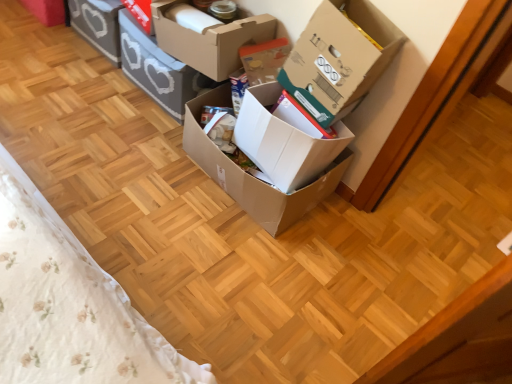
Question: Is the position of cardboard box at center, arranged as the 5th box when viewed from the left, more distant than that of cardboard box at upper right, the 6th box viewed from the left?

Choices:
 (A) no
 (B) yes

Answer: (B)

Question: From the image's perspective, is cardboard box at center, arranged as the 5th box when viewed from the left, located beneath cardboard box at upper right, which ranks as the 1th box in right-to-left order?

Choices:
 (A) yes
 (B) no

Answer: (A)

Question: Does cardboard box at center, placed as the second box when sorted from right to left, have a larger size compared to cardboard box at upper right, the 6th box viewed from the left?

Choices:
 (A) yes
 (B) no

Answer: (B)

Question: Can you confirm if cardboard box at center, arranged as the 5th box when viewed from the left, is positioned to the left of cardboard box at upper right, which ranks as the 1th box in right-to-left order?

Choices:
 (A) no
 (B) yes

Answer: (B)

Question: Is cardboard box at center, placed as the second box when sorted from right to left, positioned beyond the bounds of cardboard box at upper right, the 6th box viewed from the left?

Choices:
 (A) yes
 (B) no

Answer: (A)

Question: Considering the relative sizes of cardboard box at center, arranged as the 5th box when viewed from the left, and cardboard box at upper right, which ranks as the 1th box in right-to-left order, in the image provided, is cardboard box at center, arranged as the 5th box when viewed from the left, shorter than cardboard box at upper right, which ranks as the 1th box in right-to-left order,?

Choices:
 (A) yes
 (B) no

Answer: (A)

Question: From a real-world perspective, is cardboard box at center, which is the fourth box from right to left, on top of cardboard box at upper right, the 6th box viewed from the left?

Choices:
 (A) no
 (B) yes

Answer: (A)

Question: Can you confirm if cardboard box at center, which ranks as the third box in left-to-right order, is positioned to the right of cardboard box at upper right, the 6th box viewed from the left?

Choices:
 (A) no
 (B) yes

Answer: (A)

Question: Is cardboard box at center, which ranks as the third box in left-to-right order, oriented away from cardboard box at upper right, which ranks as the 1th box in right-to-left order?

Choices:
 (A) yes
 (B) no

Answer: (B)

Question: Considering the relative positions of cardboard box at center, which is the fourth box from right to left, and cardboard box at upper right, which ranks as the 1th box in right-to-left order, in the image provided, is cardboard box at center, which is the fourth box from right to left, to the left of cardboard box at upper right, which ranks as the 1th box in right-to-left order, from the viewer's perspective?

Choices:
 (A) yes
 (B) no

Answer: (A)

Question: Is cardboard box at center, which is the fourth box from right to left, bigger than cardboard box at upper right, which ranks as the 1th box in right-to-left order?

Choices:
 (A) no
 (B) yes

Answer: (A)

Question: Does cardboard box at center, which ranks as the third box in left-to-right order, have a lesser height compared to cardboard box at upper right, which ranks as the 1th box in right-to-left order?

Choices:
 (A) yes
 (B) no

Answer: (A)

Question: Is cardboard box at center, arranged as the 5th box when viewed from the left, facing towards matte gray storage box at upper left, which is the sixth box from right to left?

Choices:
 (A) yes
 (B) no

Answer: (B)